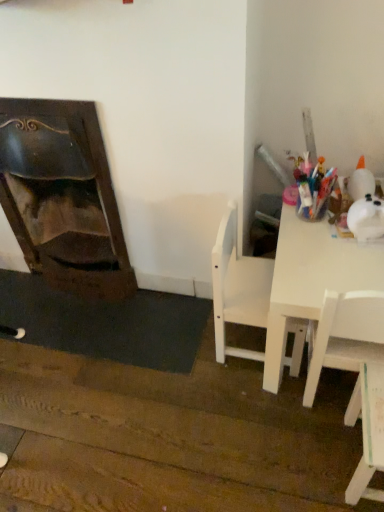
Question: Considering the relative positions of dark wood fireplace at left and white matte chair at center, marked as the 2th chair in a right-to-left arrangement, in the image provided, is dark wood fireplace at left to the left or to the right of white matte chair at center, marked as the 2th chair in a right-to-left arrangement,?

Choices:
 (A) left
 (B) right

Answer: (A)

Question: Is point (54, 258) closer or farther from the camera than point (218, 227)?

Choices:
 (A) farther
 (B) closer

Answer: (A)

Question: Which object is positioned closest to the dark wood fireplace at left?

Choices:
 (A) white matte chair at center, placed as the first chair when sorted from left to right
 (B) white glossy table at right
 (C) white matte chair at lower right, positioned as the 2th chair in left-to-right order

Answer: (A)

Question: Estimate the real-world distances between objects in this image. Which object is closer to the white glossy table at right?

Choices:
 (A) white matte chair at center, placed as the first chair when sorted from left to right
 (B) dark wood fireplace at left
 (C) white matte chair at lower right, positioned as the 2th chair in left-to-right order

Answer: (A)